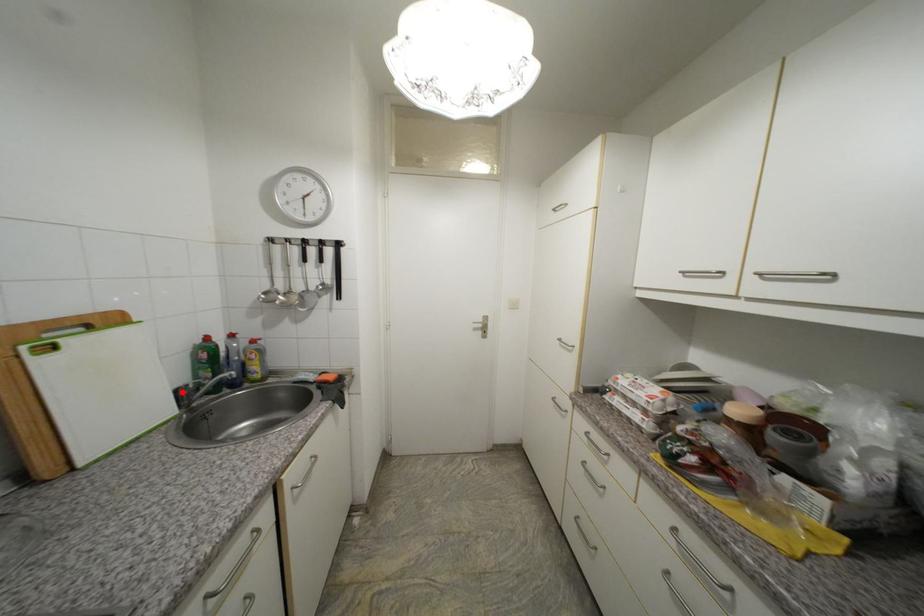
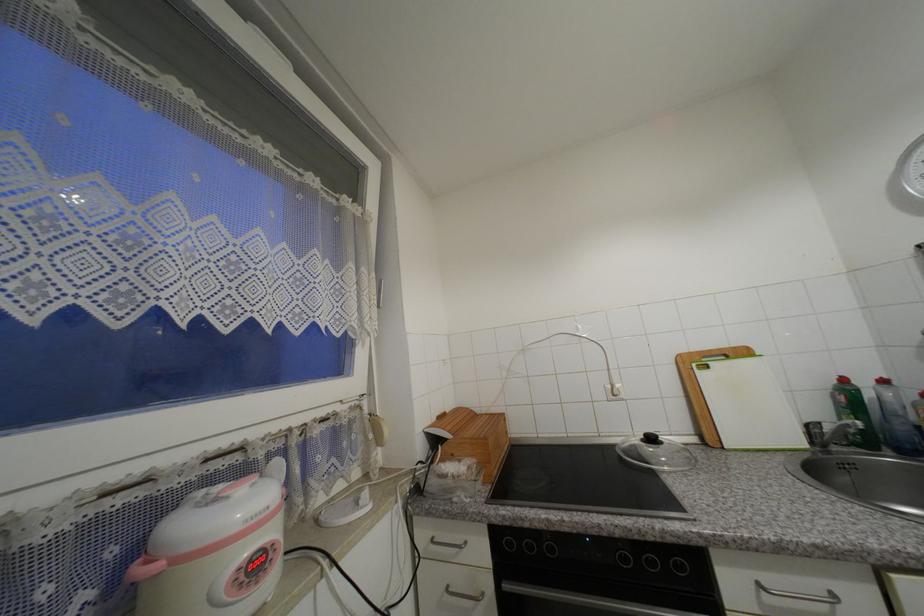
Find the pixel in the second image that matches the highlighted location in the first image.

(812, 428)